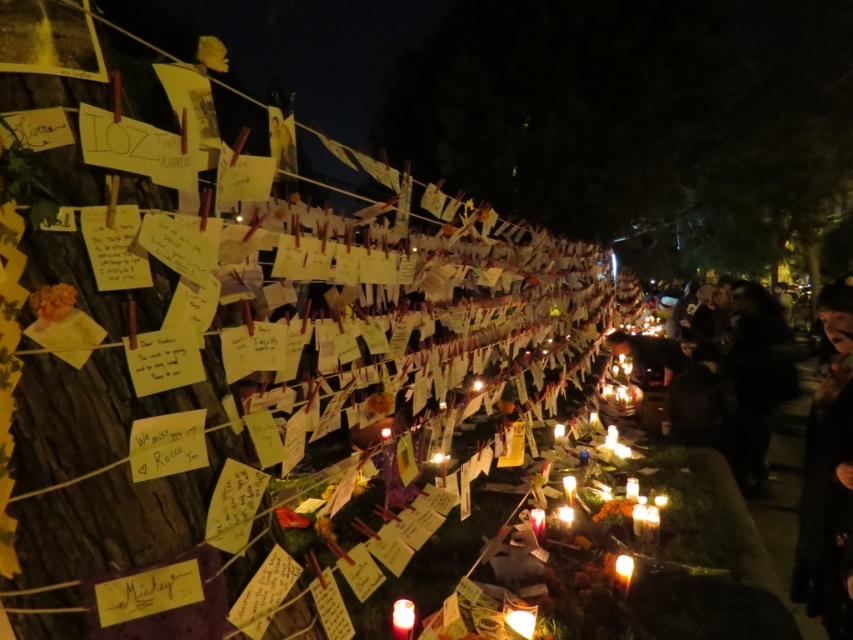
Question: Can you confirm if translucent wax candle at lower center is positioned above translucent wax candle at lower right?

Choices:
 (A) yes
 (B) no

Answer: (A)

Question: Considering the relative positions of translucent wax candle at lower center and translucent wax candle at lower right in the image provided, where is translucent wax candle at lower center located with respect to translucent wax candle at lower right?

Choices:
 (A) below
 (B) above

Answer: (B)

Question: Which point appears farthest from the camera in this image?

Choices:
 (A) (618, 579)
 (B) (409, 618)

Answer: (A)

Question: Can you confirm if translucent wax candle at lower center is positioned to the left of translucent wax candle at lower right?

Choices:
 (A) no
 (B) yes

Answer: (B)